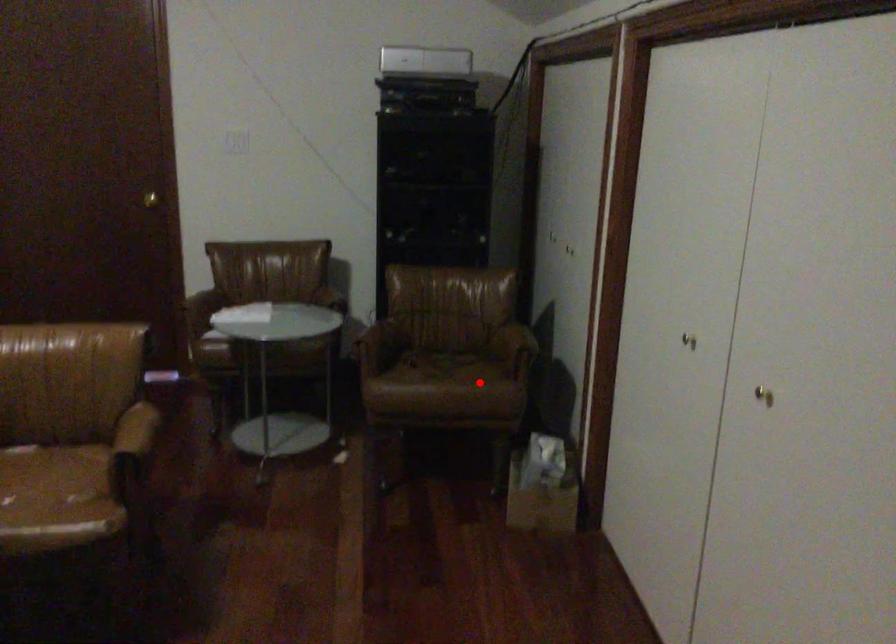
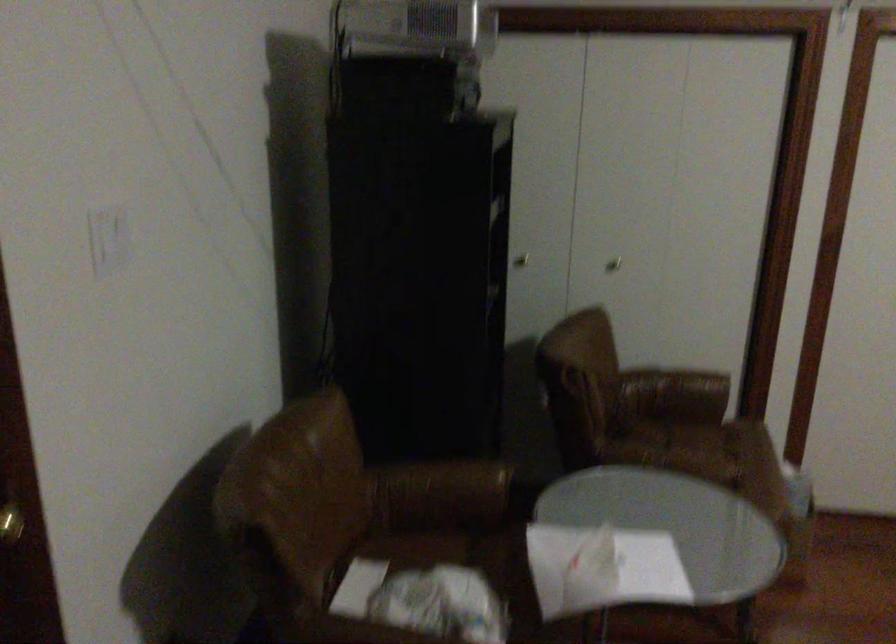
In the second image, find the point that corresponds to the highlighted location in the first image.

(718, 442)